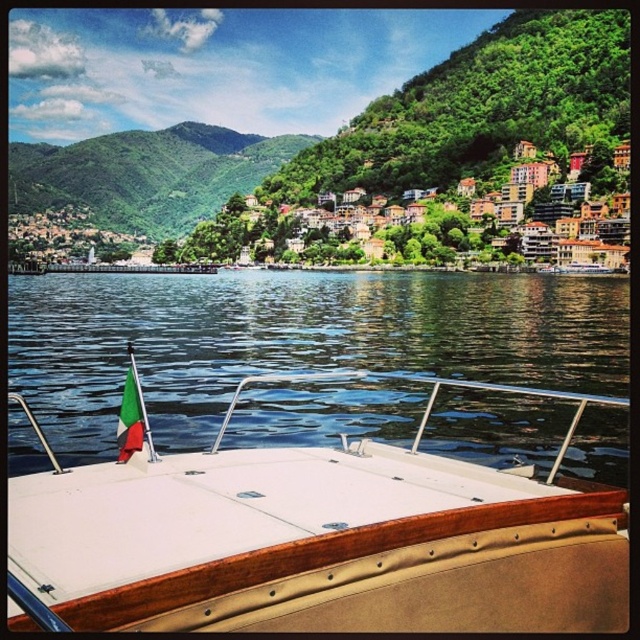
At what (x,y) coordinates should I click in order to perform the action: click on green leafy hillside at upper left. Please return your answer as a coordinate pair (x, y). The image size is (640, 640). Looking at the image, I should click on (147, 173).

Who is more forward, [42,192] or [131,376]?

Positioned in front is point [131,376].

Between point (182, 225) and point (138, 392), which one is positioned behind?

Positioned behind is point (182, 225).

Locate an element on the screen. This screenshot has height=640, width=640. green leafy hillside at upper left is located at coordinates (147, 173).

Who is positioned more to the left, clear water at boat front or green leafy hillside at upper left?

From the viewer's perspective, green leafy hillside at upper left appears more on the left side.

Based on the photo, is clear water at boat front above green leafy hillside at upper left?

Incorrect, clear water at boat front is not positioned above green leafy hillside at upper left.

Which is in front, point (481, 298) or point (147, 216)?

Point (481, 298) is more forward.

The width and height of the screenshot is (640, 640). I want to click on clear water at boat front, so click(x=292, y=339).

Is clear water at boat front wider than green fabric flag at center?

Correct, the width of clear water at boat front exceeds that of green fabric flag at center.

Identify the location of clear water at boat front. This screenshot has width=640, height=640. (292, 339).

Identify the location of clear water at boat front. (292, 339).